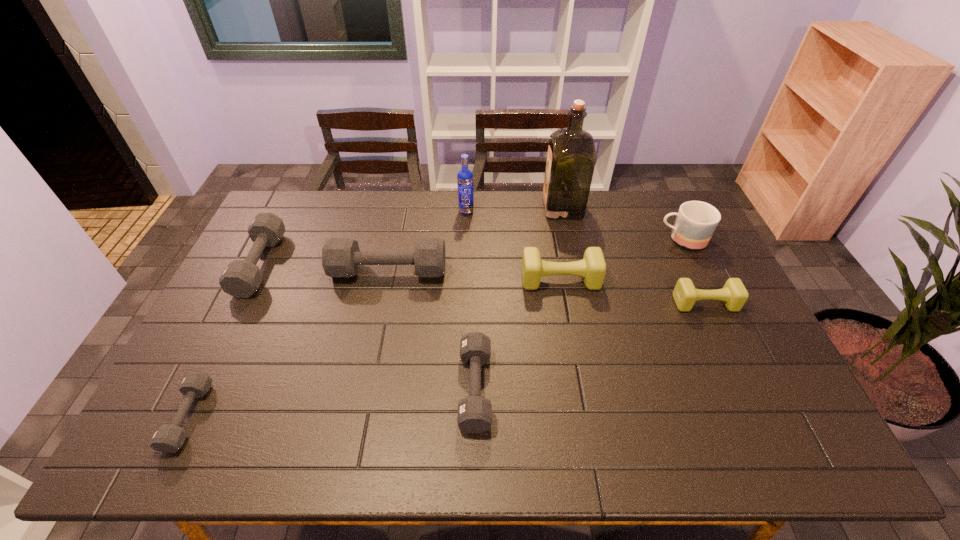
You are a GUI agent. You are given a task and a screenshot of the screen. Output one action in this format:
    pyautogui.click(x=<x>, y=<y>)
    Task: Click on the free region located on the side with the handle of the blue mug
    
    Given the screenshot: What is the action you would take?
    pyautogui.click(x=634, y=239)

In order to click on vacant space located 0.270m on the side with the handle of the blue mug in this screenshot , I will do pyautogui.click(x=578, y=239).

Where is `free space located 0.050m on the side with the handle of the blue mug`? The image size is (960, 540). free space located 0.050m on the side with the handle of the blue mug is located at coordinates (642, 239).

Locate an element on the screen. free spot located 0.370m on the back of the fifth dumbbell from left to right is located at coordinates [546, 200].

Where is `free region located 0.110m on the back of the second biggest gray dumbbell`? Image resolution: width=960 pixels, height=540 pixels. free region located 0.110m on the back of the second biggest gray dumbbell is located at coordinates (285, 214).

Where is `blank area located 0.220m on the right of the rightmost gray dumbbell`? This screenshot has width=960, height=540. blank area located 0.220m on the right of the rightmost gray dumbbell is located at coordinates (578, 388).

This screenshot has width=960, height=540. Find the location of `free spot located 0.160m on the back of the smaller olive dumbbell`. free spot located 0.160m on the back of the smaller olive dumbbell is located at coordinates (684, 258).

Identify the location of free location located 0.140m on the right of the shortest object. (259, 416).

Find the location of a particular element. This screenshot has width=960, height=540. liquor at the far edge is located at coordinates (571, 157).

The image size is (960, 540). In order to click on vodka positioned at the far edge in this screenshot , I will do `click(465, 176)`.